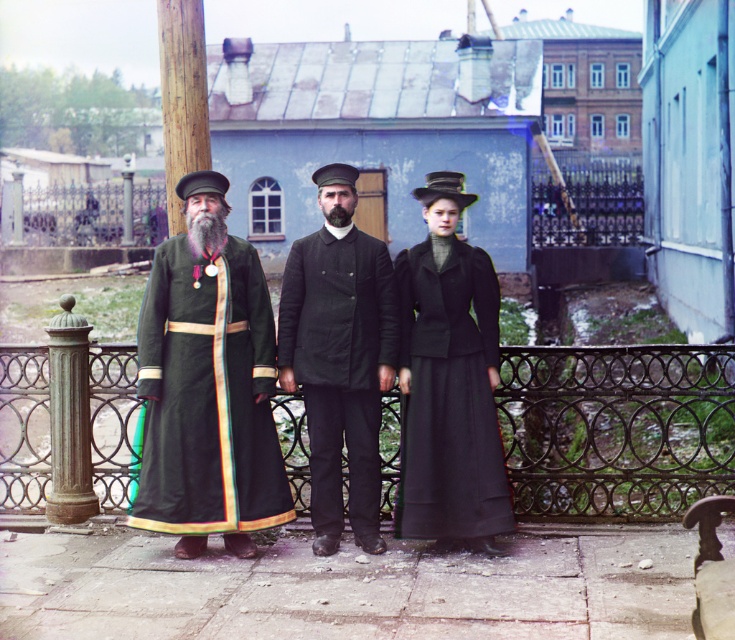
You are a photographer trying to arrange three people for a group photo. The scene has a dark wool coat at center and graywoollybeard at center. According to the current arrangement, which object is positioned to the right of the other?

The dark wool coat at center is to the right of graywoollybeard at center.